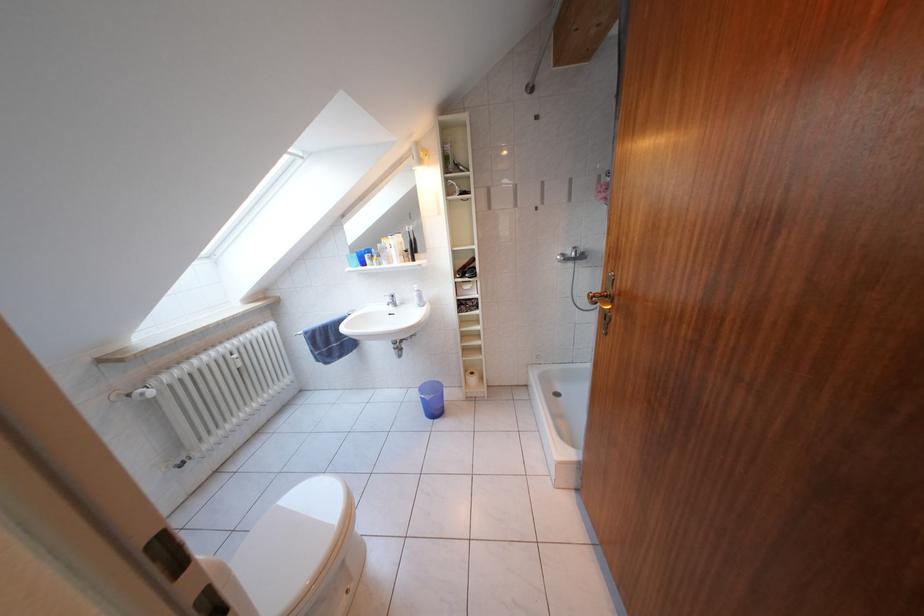
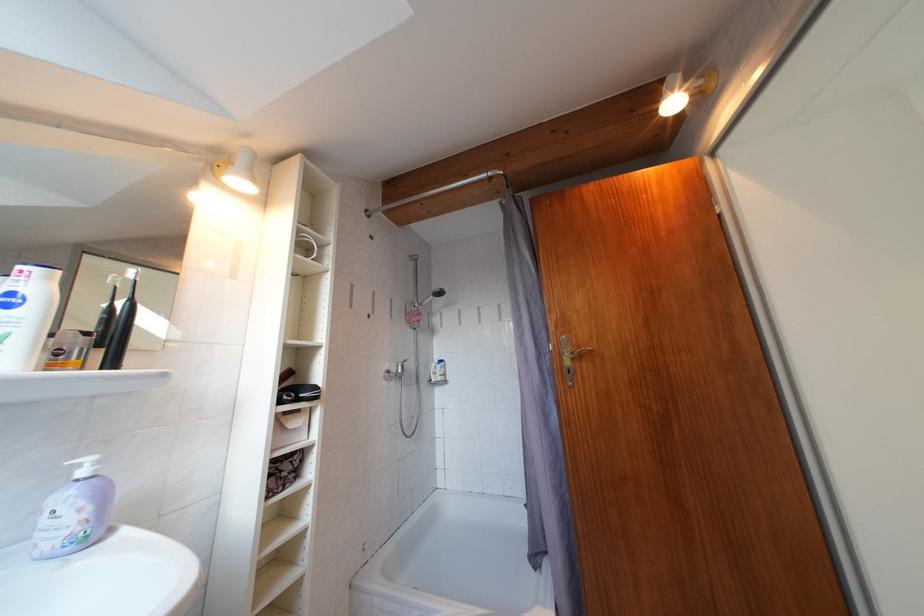
Find the pixel in the second image that matches the point at 572,260 in the first image.

(396, 377)